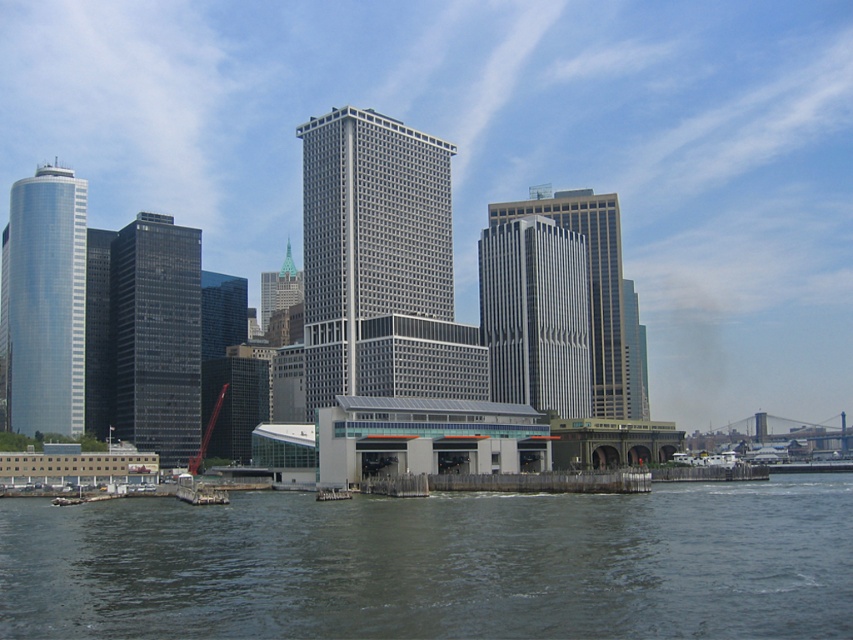
You are standing on the wooden pier looking towards the city skyline. You see the shiny glass skyscraper at left and the green glass skyscraper at center. Which one is positioned more to the left side of your view?

The shiny glass skyscraper at left is positioned more to the left side of your view than the green glass skyscraper at center.

You are standing on the wooden pier and see the gray concrete river at lower center and the gray metallic skyscraper at center. Which object is nearer to you?

The gray concrete river at lower center is closer to the viewer than the gray metallic skyscraper at center.

You are standing on the wooden pier near the ferry terminal and looking out at the city skyline. Which of the two skyscrapers, the glassy reflective skyscraper at left or the silver glass skyscraper at center, appears nearer to you?

The glassy reflective skyscraper at left appears nearer to you because it is closer to the viewer than the silver glass skyscraper at center.